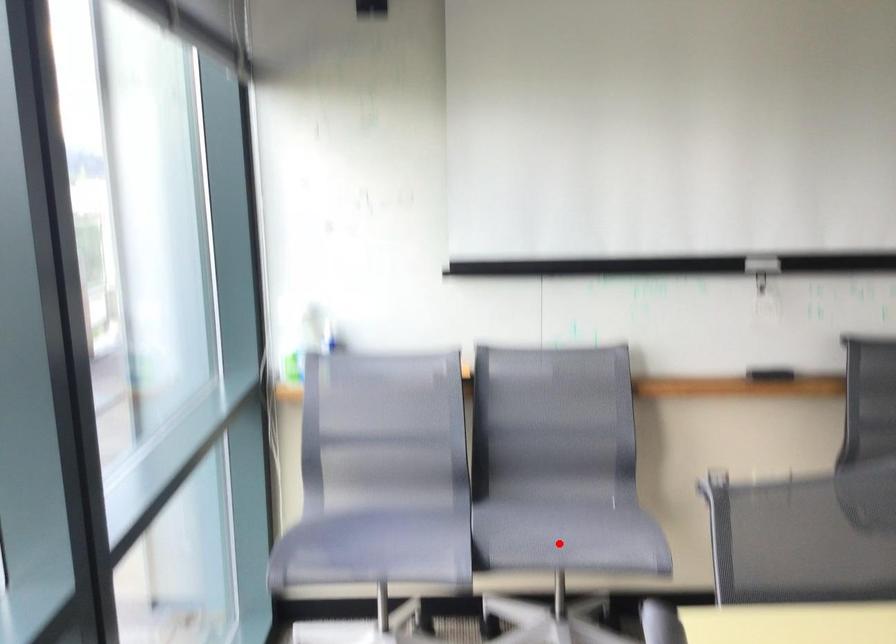
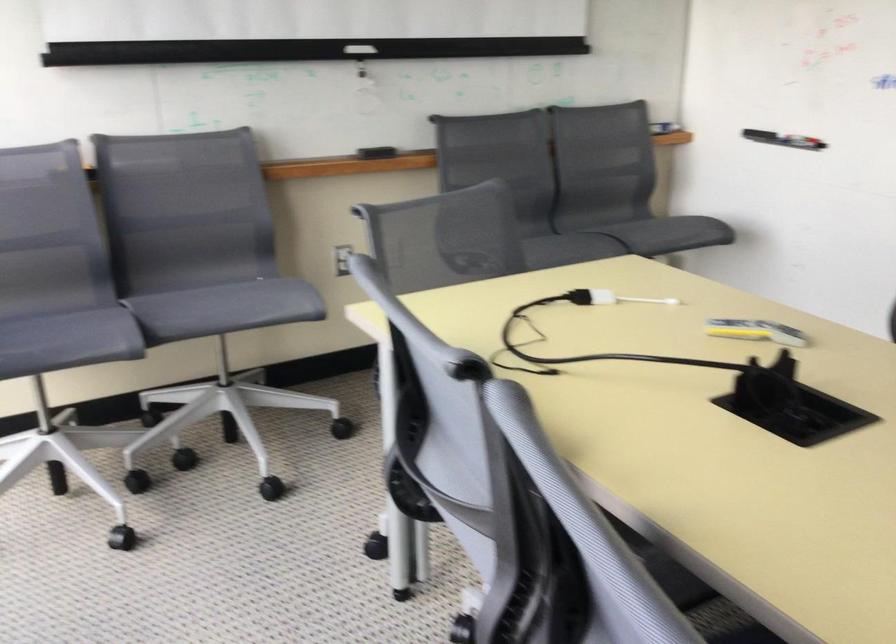
Locate, in the second image, the point that corresponds to the highlighted location in the first image.

(225, 308)